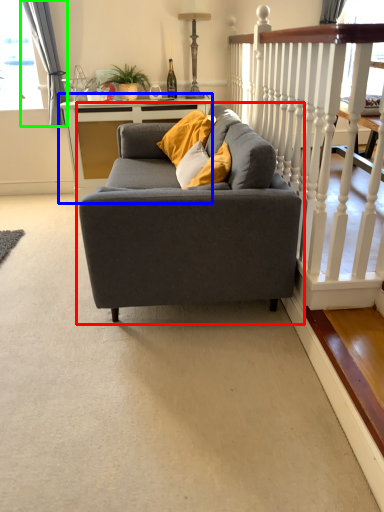
Question: Which object is the farthest from studio couch (highlighted by a red box)? Choose among these: table (highlighted by a blue box) or curtain (highlighted by a green box).

Choices:
 (A) table
 (B) curtain

Answer: (B)